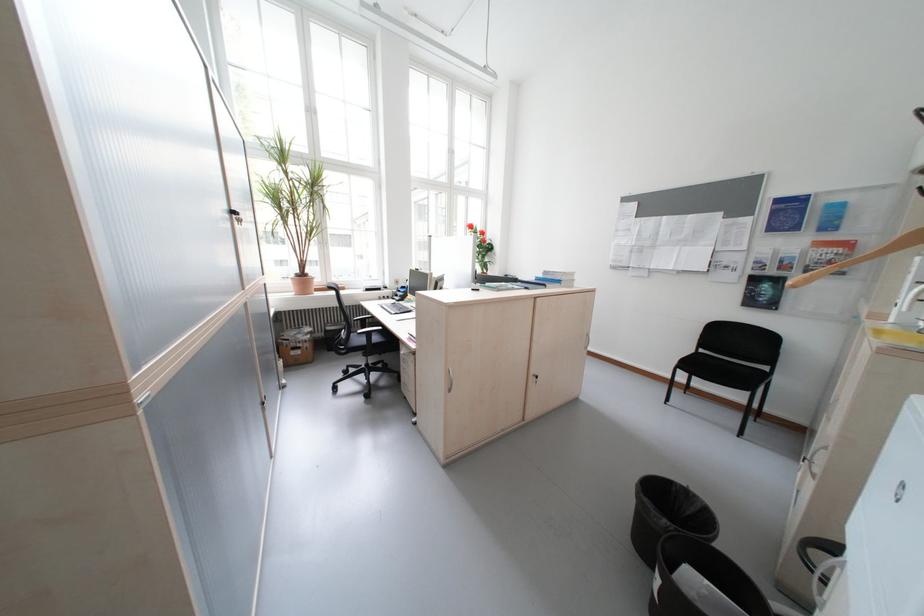
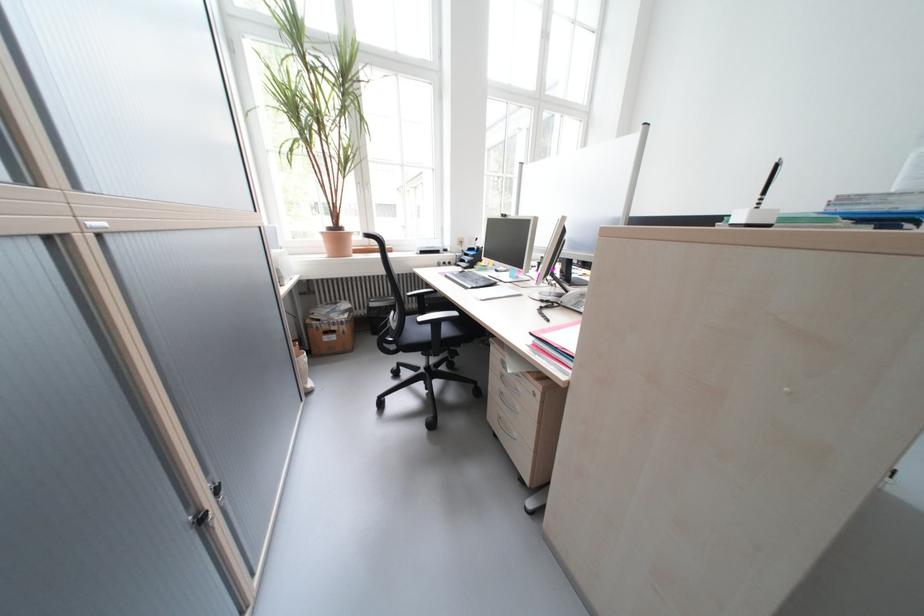
Where in the second image is the point corresponding to the point at 274,405 from the first image?

(213, 521)